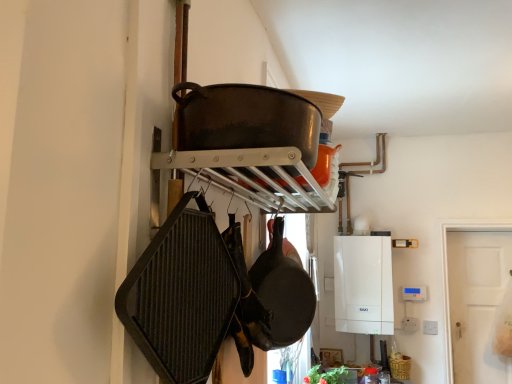
Question: Is black matte frying pan at center, the second frying pan when ordered from front to back, to the right of dark brown cast iron wok at upper center from the viewer's perspective?

Choices:
 (A) no
 (B) yes

Answer: (B)

Question: From a real-world perspective, is black matte frying pan at center, placed as the 2th frying pan when sorted from left to right, under dark brown cast iron wok at upper center?

Choices:
 (A) no
 (B) yes

Answer: (B)

Question: From a real-world perspective, does black matte frying pan at center, which is counted as the 1th frying pan, starting from the right, stand above dark brown cast iron wok at upper center?

Choices:
 (A) no
 (B) yes

Answer: (A)

Question: Is black matte frying pan at center, which is counted as the 1th frying pan, starting from the right, in contact with dark brown cast iron wok at upper center?

Choices:
 (A) no
 (B) yes

Answer: (A)

Question: Can you confirm if black matte frying pan at center, which is counted as the 1th frying pan, starting from the right, is thinner than dark brown cast iron wok at upper center?

Choices:
 (A) no
 (B) yes

Answer: (B)

Question: Looking at the image, does dark gray textured frying pan at left, placed as the first frying pan when sorted from left to right, seem bigger or smaller compared to dark brown cast iron wok at upper center?

Choices:
 (A) small
 (B) big

Answer: (A)

Question: In terms of width, does dark gray textured frying pan at left, placed as the first frying pan when sorted from left to right, look wider or thinner when compared to dark brown cast iron wok at upper center?

Choices:
 (A) thin
 (B) wide

Answer: (A)

Question: Considering the relative positions of dark gray textured frying pan at left, which is the 2th frying pan from back to front, and dark brown cast iron wok at upper center in the image provided, is dark gray textured frying pan at left, which is the 2th frying pan from back to front, to the left or to the right of dark brown cast iron wok at upper center?

Choices:
 (A) right
 (B) left

Answer: (B)

Question: From their relative heights in the image, would you say dark gray textured frying pan at left, which ranks as the 2th frying pan in right-to-left order, is taller or shorter than dark brown cast iron wok at upper center?

Choices:
 (A) short
 (B) tall

Answer: (B)

Question: Considering their positions, is black matte frying pan at center, the second frying pan when ordered from front to back, located in front of or behind dark brown cast iron wok at upper center?

Choices:
 (A) front
 (B) behind

Answer: (B)

Question: Would you say black matte frying pan at center, the second frying pan when ordered from front to back, is inside or outside dark brown cast iron wok at upper center?

Choices:
 (A) outside
 (B) inside

Answer: (A)

Question: In terms of width, does black matte frying pan at center, the second frying pan when ordered from front to back, look wider or thinner when compared to dark brown cast iron wok at upper center?

Choices:
 (A) wide
 (B) thin

Answer: (B)

Question: From the image's perspective, is black matte frying pan at center, which is counted as the 1th frying pan, starting from the right, positioned above or below dark brown cast iron wok at upper center?

Choices:
 (A) above
 (B) below

Answer: (B)

Question: Is dark gray textured frying pan at left, which ranks as the 2th frying pan in right-to-left order, to the left or to the right of black matte frying pan at center, placed as the 1th frying pan when sorted from back to front, in the image?

Choices:
 (A) right
 (B) left

Answer: (B)

Question: From their relative heights in the image, would you say dark gray textured frying pan at left, which is the first frying pan from front to back, is taller or shorter than black matte frying pan at center, the second frying pan when ordered from front to back?

Choices:
 (A) tall
 (B) short

Answer: (B)